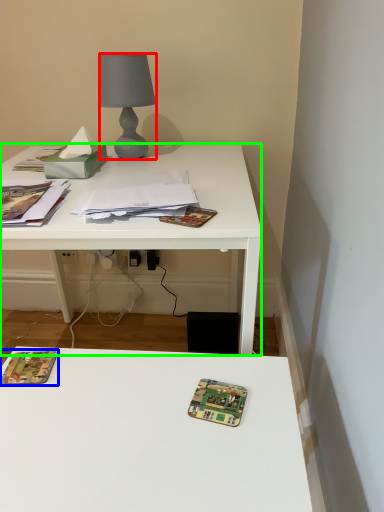
Question: Based on their relative distances, which object is nearer to lamp (highlighted by a red box)? Choose from paperback book (highlighted by a blue box) and desk (highlighted by a green box).

Choices:
 (A) paperback book
 (B) desk

Answer: (B)